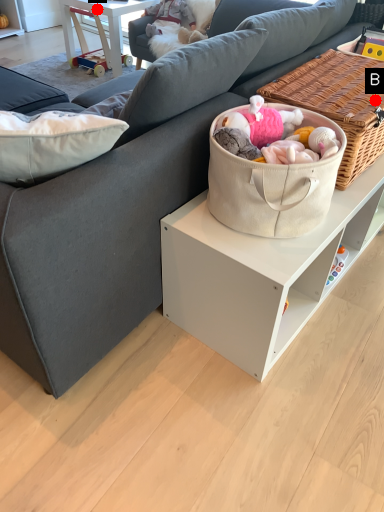
Question: Two points are circled on the image, labeled by A and B beside each circle. Which point is closer to the camera taking this photo?

Choices:
 (A) A is closer
 (B) B is closer

Answer: (B)